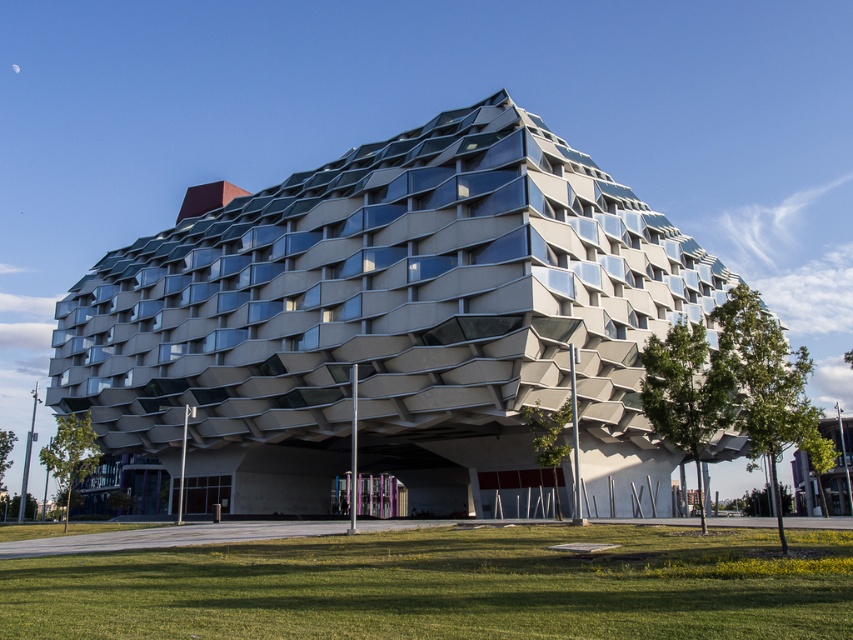
Can you confirm if textured concrete building at center is wider than green grass at lower center?

Correct, the width of textured concrete building at center exceeds that of green grass at lower center.

In the scene shown: Between textured concrete building at center and green grass at lower center, which one has more height?

Standing taller between the two is textured concrete building at center.

Is point (73, 292) positioned before point (845, 618)?

No, it is not.

Identify the location of textured concrete building at center. Image resolution: width=853 pixels, height=640 pixels. (387, 324).